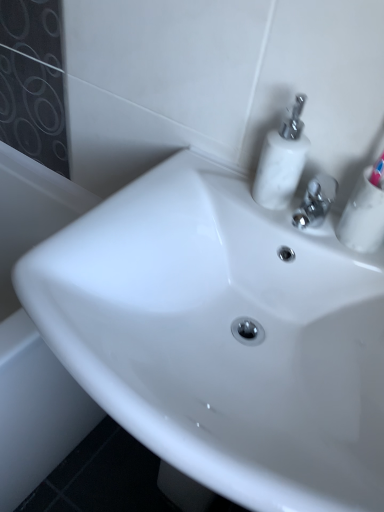
Question: Is white glossy bath at lower left to the right of white glossy sink at center from the viewer's perspective?

Choices:
 (A) no
 (B) yes

Answer: (A)

Question: Considering the relative sizes of white glossy bath at lower left and white glossy sink at center in the image provided, is white glossy bath at lower left wider than white glossy sink at center?

Choices:
 (A) no
 (B) yes

Answer: (B)

Question: Is the position of white glossy bath at lower left less distant than that of white glossy sink at center?

Choices:
 (A) yes
 (B) no

Answer: (B)

Question: Is the position of white glossy bath at lower left more distant than that of white glossy sink at center?

Choices:
 (A) yes
 (B) no

Answer: (A)

Question: Is white glossy bath at lower left not inside white glossy sink at center?

Choices:
 (A) yes
 (B) no

Answer: (A)

Question: Does white glossy bath at lower left have a greater height compared to white glossy sink at center?

Choices:
 (A) yes
 (B) no

Answer: (B)

Question: Does white glossy soap dispenser at upper right have a lesser width compared to white glossy sink at center?

Choices:
 (A) no
 (B) yes

Answer: (B)

Question: From a real-world perspective, is white glossy soap dispenser at upper right positioned under white glossy sink at center based on gravity?

Choices:
 (A) no
 (B) yes

Answer: (A)

Question: From a real-world perspective, is white glossy soap dispenser at upper right over white glossy sink at center?

Choices:
 (A) no
 (B) yes

Answer: (B)

Question: Is white glossy soap dispenser at upper right directly adjacent to white glossy sink at center?

Choices:
 (A) yes
 (B) no

Answer: (B)

Question: Considering the relative positions of white glossy soap dispenser at upper right and white glossy sink at center in the image provided, is white glossy soap dispenser at upper right to the left of white glossy sink at center from the viewer's perspective?

Choices:
 (A) no
 (B) yes

Answer: (A)

Question: Is white glossy soap dispenser at upper right wider than white glossy sink at center?

Choices:
 (A) yes
 (B) no

Answer: (B)

Question: Is white glossy soap dispenser at upper right bigger than white glossy mouthwash at upper right?

Choices:
 (A) no
 (B) yes

Answer: (A)